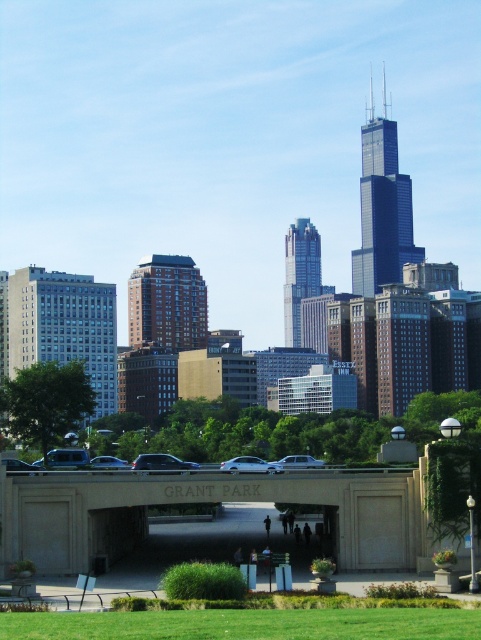
Question: Where is beige concrete overpass at center located in relation to silver metallic sedan at center in the image?

Choices:
 (A) right
 (B) left

Answer: (B)

Question: Based on their relative distances, which object is farther from the beige concrete overpass at center?

Choices:
 (A) silver metallic sedan at center
 (B) matte black car at center
 (C) concrete bridge at center

Answer: (C)

Question: Where is beige concrete overpass at center located in relation to matte black car at center in the image?

Choices:
 (A) above
 (B) below

Answer: (A)

Question: Is concrete bridge at center smaller than matte black car at center?

Choices:
 (A) no
 (B) yes

Answer: (A)

Question: Which object is the farthest from the shiny black sedan at center?

Choices:
 (A) white matte car at center
 (B) matte black car at center
 (C) beige concrete overpass at center
 (D) concrete bridge at center

Answer: (D)

Question: Which object is positioned closest to the silver metallic sedan at center?

Choices:
 (A) beige concrete overpass at center
 (B) matte black car at center
 (C) white matte car at center

Answer: (A)